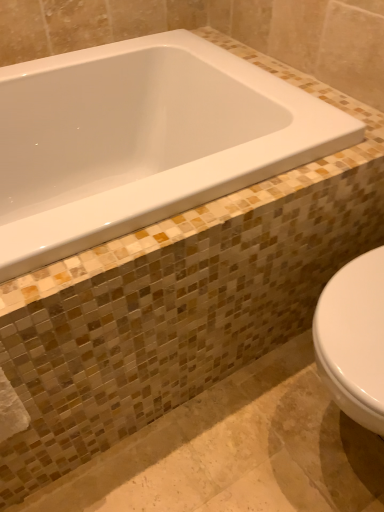
The width and height of the screenshot is (384, 512). What do you see at coordinates (142, 140) in the screenshot?
I see `white glossy bathtub at upper left` at bounding box center [142, 140].

What are the coordinates of `white glossy bathtub at upper left` in the screenshot? It's located at (142, 140).

Locate an element on the screen. The width and height of the screenshot is (384, 512). white glossy bathtub at upper left is located at coordinates (142, 140).